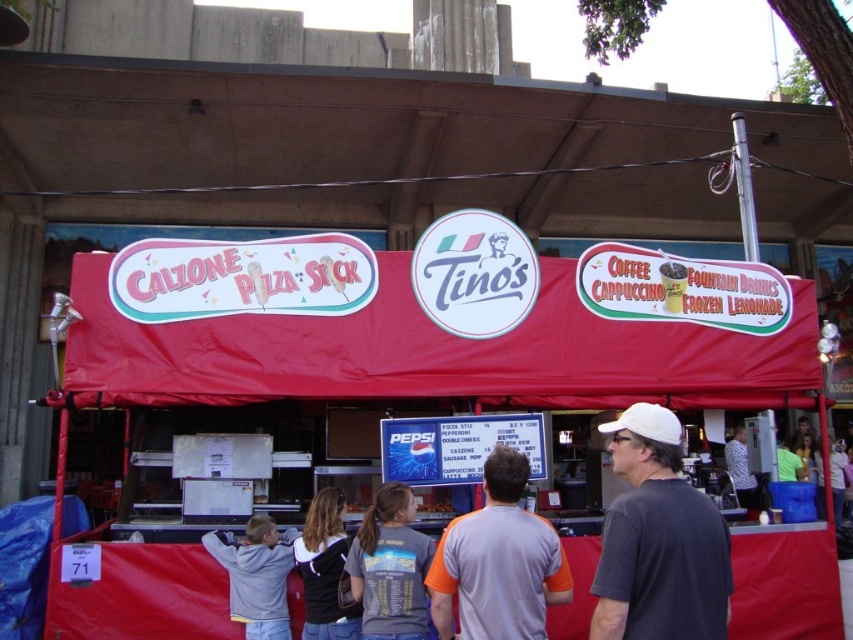
Is dark gray t-shirt at center thinner than shiny plastic french fries at center?

Incorrect, dark gray t-shirt at center's width is not less than shiny plastic french fries at center's.

Does point (396, 589) come behind point (439, 509)?

No, it is in front of (439, 509).

Is point (416, 636) less distant than point (450, 508)?

That is True.

The image size is (853, 640). What are the coordinates of `dark gray t-shirt at center` in the screenshot? It's located at (390, 568).

Between yellow fabric shirt at center and shiny plastic french fries at center, which one is positioned higher?

shiny plastic french fries at center is above.

Where is `yellow fabric shirt at center`? yellow fabric shirt at center is located at coordinates (805, 456).

Who is higher up, white matte baseball cap at upper right or black hoodie at center?

Positioned higher is white matte baseball cap at upper right.

Does white matte baseball cap at upper right have a lesser width compared to black hoodie at center?

Incorrect, white matte baseball cap at upper right's width is not less than black hoodie at center's.

Is point (643, 513) positioned after point (343, 552)?

No, it is not.

You are a GUI agent. You are given a task and a screenshot of the screen. Output one action in this format:
    pyautogui.click(x=<x>, y=<y>)
    Task: Click on the white matte baseball cap at upper right
    Image resolution: width=853 pixels, height=640 pixels.
    Given the screenshot: What is the action you would take?
    pyautogui.click(x=659, y=540)